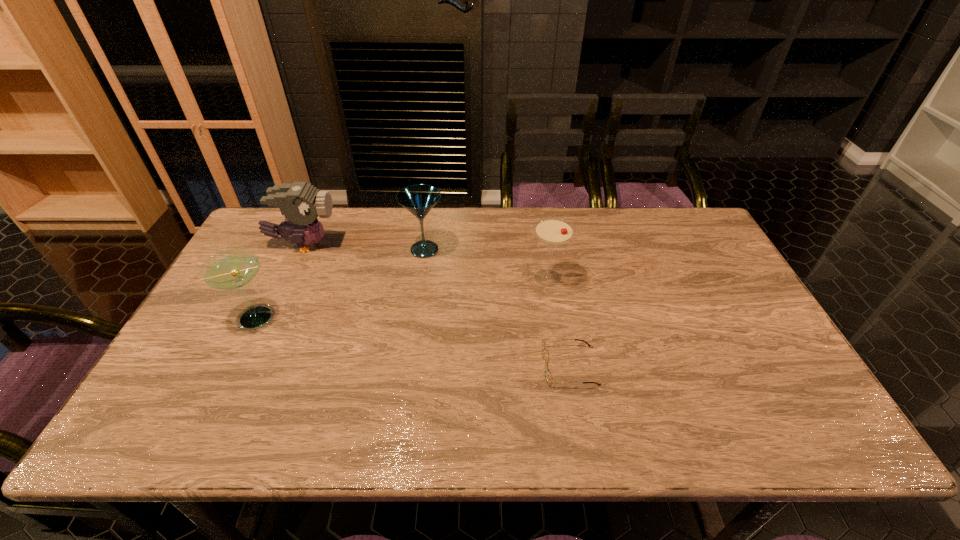
Locate an element on the screen. free space located on the front of the farthest martini is located at coordinates (415, 318).

Identify the location of free location located on the front of the leftmost martini. (215, 403).

Where is `blank space located on the right of the third farthest object`? The image size is (960, 540). blank space located on the right of the third farthest object is located at coordinates (585, 278).

Image resolution: width=960 pixels, height=540 pixels. I want to click on free point located 0.360m on the lenses of the nearest object, so click(396, 366).

The height and width of the screenshot is (540, 960). Find the location of `blank space located 0.310m on the lenses of the nearest object`. blank space located 0.310m on the lenses of the nearest object is located at coordinates (417, 366).

Where is `vacant space located 0.120m on the lenses of the nearest object`? The height and width of the screenshot is (540, 960). vacant space located 0.120m on the lenses of the nearest object is located at coordinates (493, 366).

This screenshot has width=960, height=540. I want to click on bird present at the far edge, so click(300, 202).

Locate an element on the screen. martini present at the far edge is located at coordinates (418, 199).

I want to click on bird that is at the left edge, so click(300, 202).

Locate an element on the screen. The width and height of the screenshot is (960, 540). martini that is at the left edge is located at coordinates (230, 269).